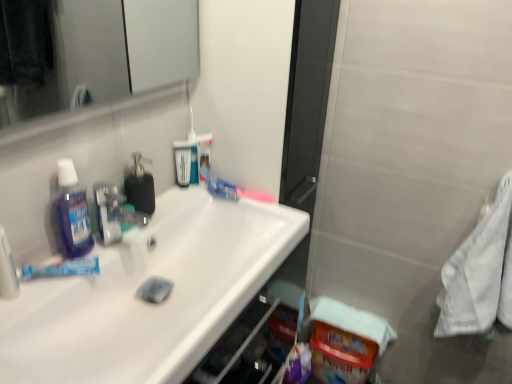
Locate an element on the screen. free space between blue glossy mouthwash at upper center, which ranks as the first mouthwash in right-to-left order, and black rubber soap dispenser at center is located at coordinates (178, 199).